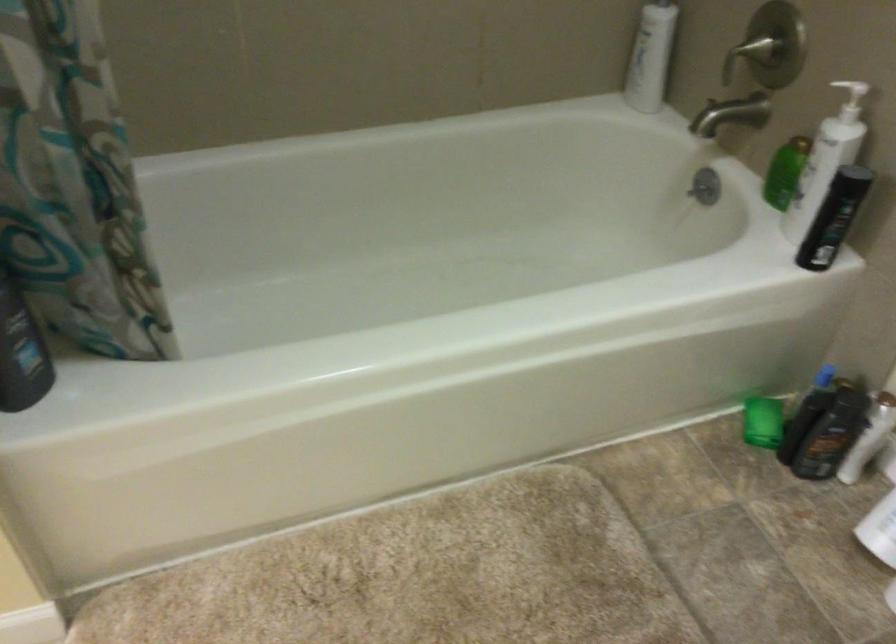
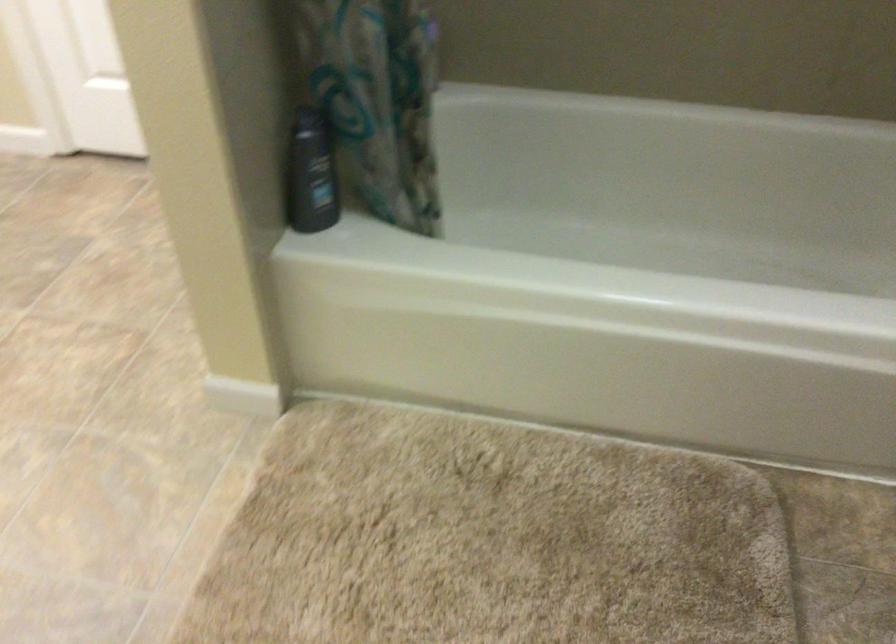
Question: The camera is either moving clockwise (left) or counter-clockwise (right) around the object. The first image is from the beginning of the video and the second image is from the end. Is the camera moving left or right when shooting the video?

Choices:
 (A) Left
 (B) Right

Answer: (B)